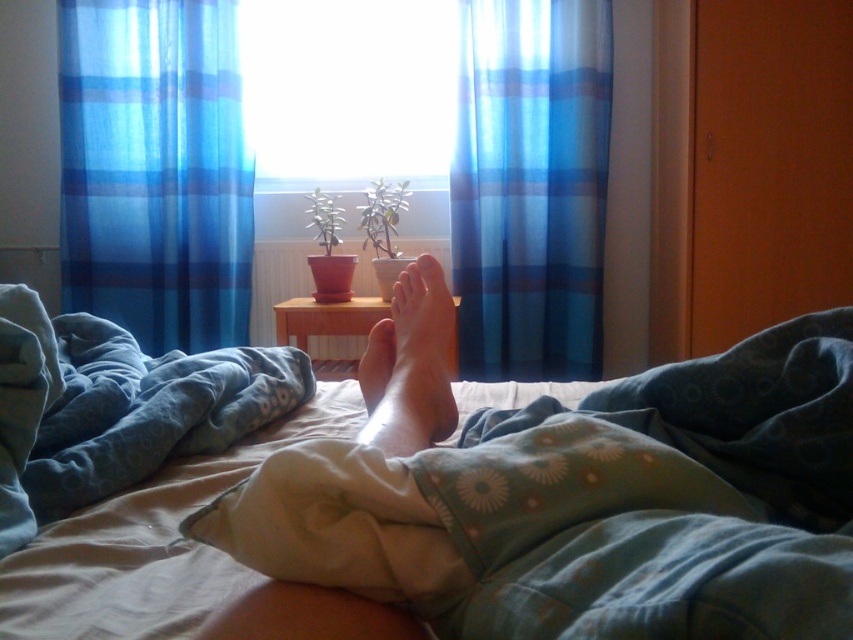
You are trying to reach the blue soft blanket at lower center from the soft cotton bed at center. Can you do so without moving the bed?

The soft cotton bed at center is below the blue soft blanket at lower center, so you can easily reach the blue soft blanket at lower center from the bed without moving it.

You are a photographer setting up a shoot in this room. You want to ensure that the blue sheer curtain at left and the smooth skin foot at center are both visible in the frame. Based on their sizes, is there a chance that one might block the view of the other?

The blue sheer curtain at left might be wider than smooth skin foot at center, so there is a possibility that the blue sheer curtain at left could block the view of the smooth skin foot at center depending on their positioning.

You are trying to see outside through the transparent glass window at center but the blue sheer curtain at left is blocking your view. Which object should you move to get a clear view?

You should move the blue sheer curtain at left because it is positioned below the transparent glass window at center and is blocking the view.